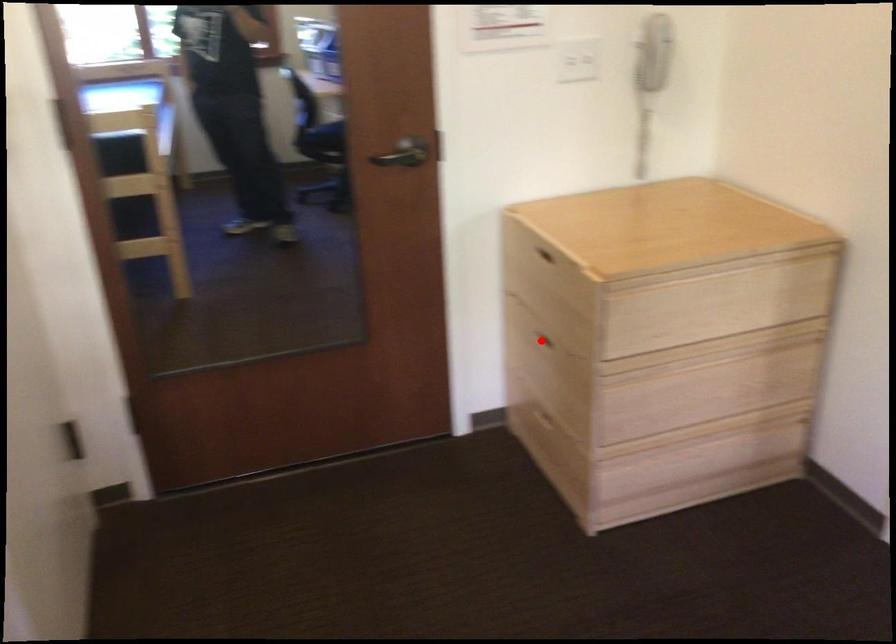
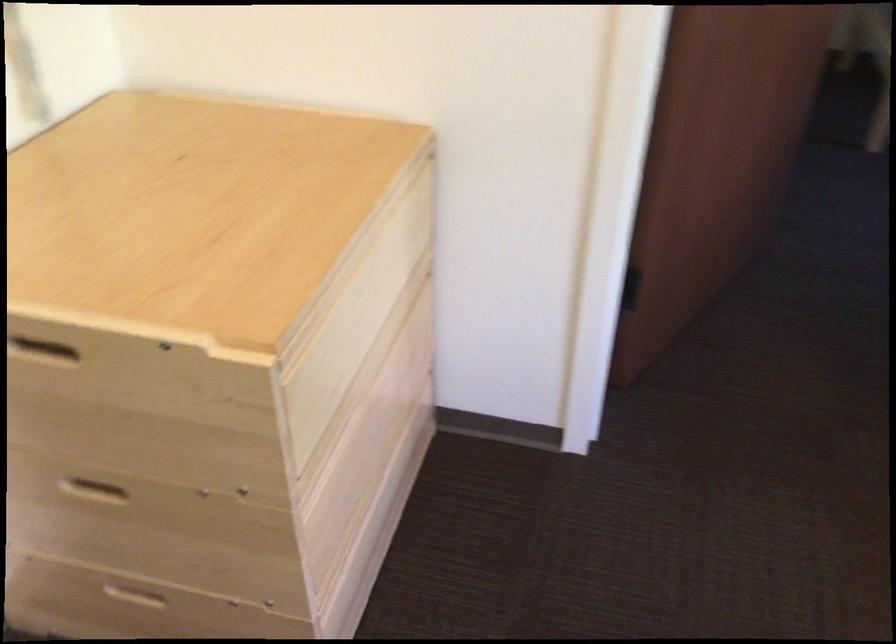
Question: I am providing you with two images of the same scene from different viewpoints. A red point is marked on the first image. At the location where the point appears in image 1, is it still visible in image 2?

Choices:
 (A) Yes
 (B) No

Answer: (A)